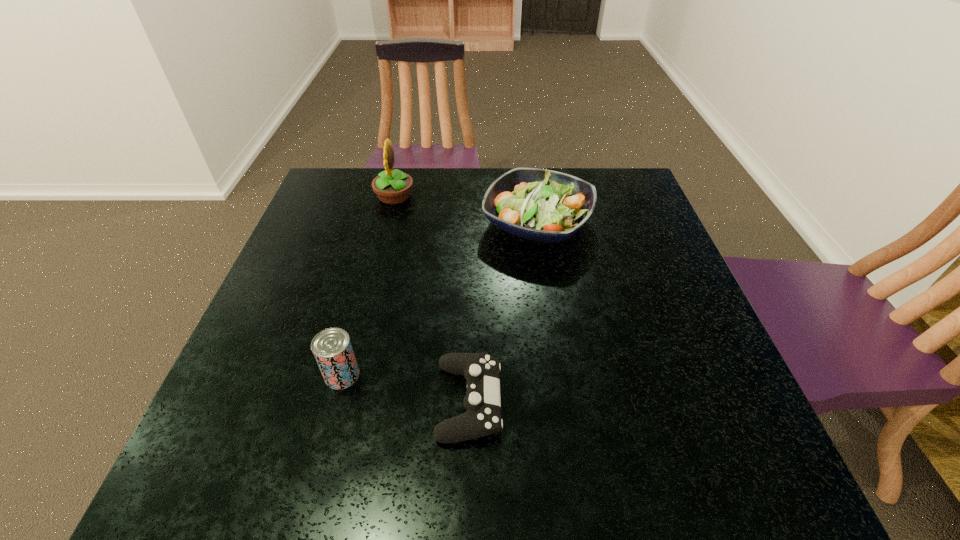
You are a GUI agent. You are given a task and a screenshot of the screen. Output one action in this format:
    pyautogui.click(x=<x>, y=<y>)
    Task: Click on the vacant point located between the beer can and the control
    
    Given the screenshot: What is the action you would take?
    [406, 388]

The width and height of the screenshot is (960, 540). I want to click on blank region between the salad plate and the beer can, so click(x=440, y=299).

Where is `vacant space in between the tallest object and the control`? vacant space in between the tallest object and the control is located at coordinates (432, 299).

Find the location of a particular element. vacant point located between the beer can and the salad plate is located at coordinates (440, 299).

Find the location of a particular element. This screenshot has width=960, height=540. unoccupied area between the salad plate and the control is located at coordinates (503, 312).

The width and height of the screenshot is (960, 540). What are the coordinates of `free spot between the beer can and the control` in the screenshot? It's located at (406, 388).

The width and height of the screenshot is (960, 540). I want to click on free space between the sunflower and the salad plate, so click(466, 210).

The image size is (960, 540). I want to click on the closest object to the sunflower, so click(x=542, y=205).

At what (x,y) coordinates should I click in order to perform the action: click on object that ranks as the second closest to the tallest object. Please return your answer as a coordinate pair (x, y). The image size is (960, 540). Looking at the image, I should click on 332,348.

Identify the location of vacant point that satisfies the following two spatial constraints: 1. on the back side of the salad plate; 2. on the face of the sunflower. (533, 197).